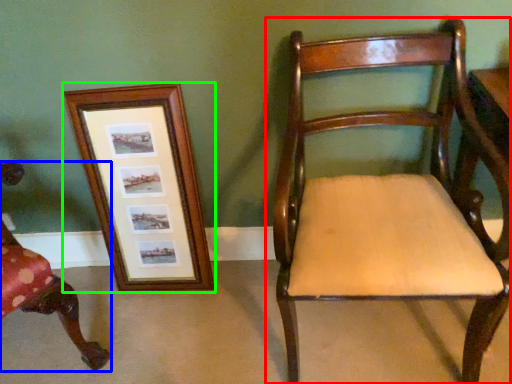
Question: Based on their relative distances, which object is farther from chair (highlighted by a red box)? Choose from chair (highlighted by a blue box) and picture frame (highlighted by a green box).

Choices:
 (A) chair
 (B) picture frame

Answer: (A)